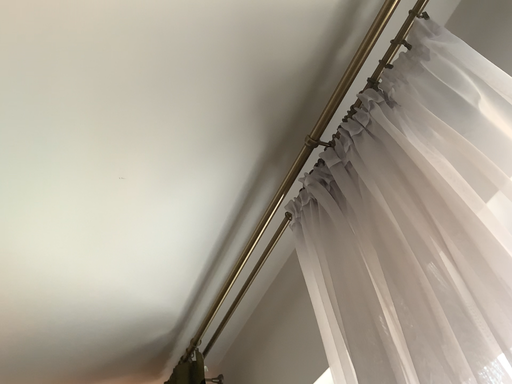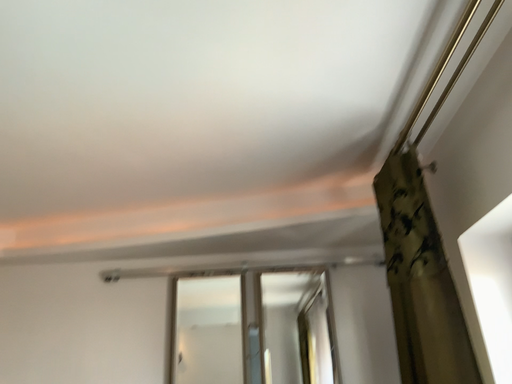
Question: How did the camera likely rotate when shooting the video?

Choices:
 (A) rotated downward
 (B) rotated upward

Answer: (A)